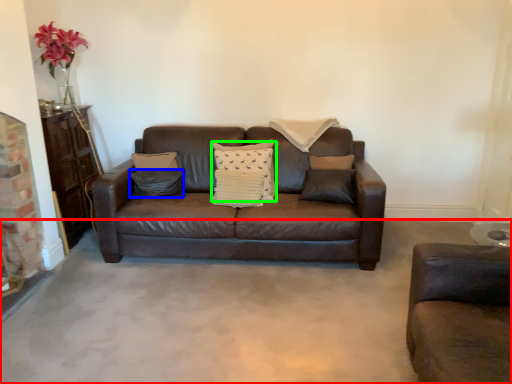
Question: Which object is the farthest from concrete (highlighted by a red box)? Choose among these: pillow (highlighted by a blue box) or pillow (highlighted by a green box).

Choices:
 (A) pillow
 (B) pillow

Answer: (A)